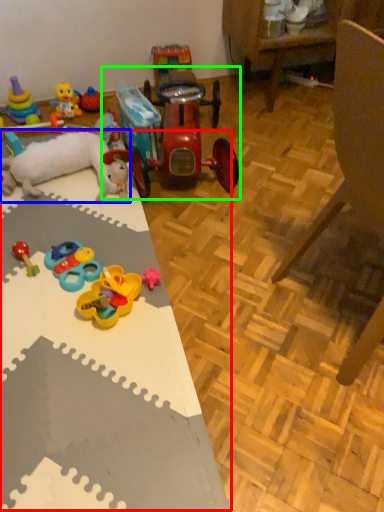
Question: Based on their relative distances, which object is farther from table (highlighted by a red box)? Choose from toy (highlighted by a blue box) and toy (highlighted by a green box).

Choices:
 (A) toy
 (B) toy

Answer: (B)